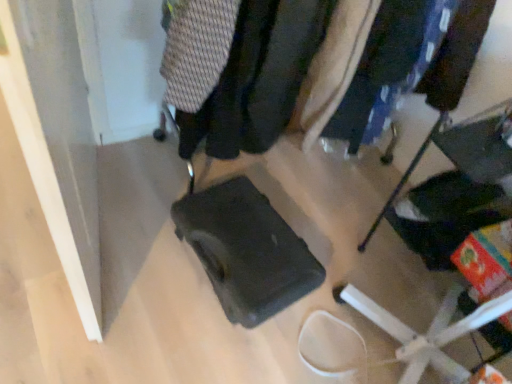
This screenshot has height=384, width=512. I want to click on free point below matte black suitcase at center (from a real-world perspective), so click(x=359, y=345).